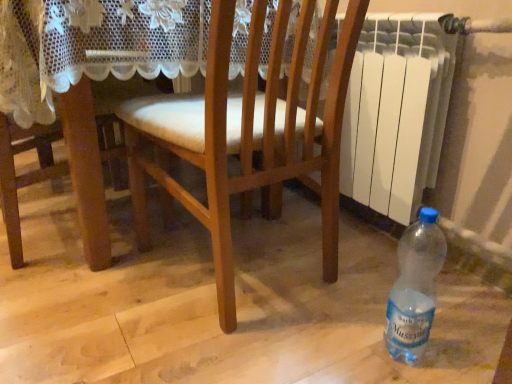
Identify the location of vacant space situated on the left part of wooden chair at center. 87,286.